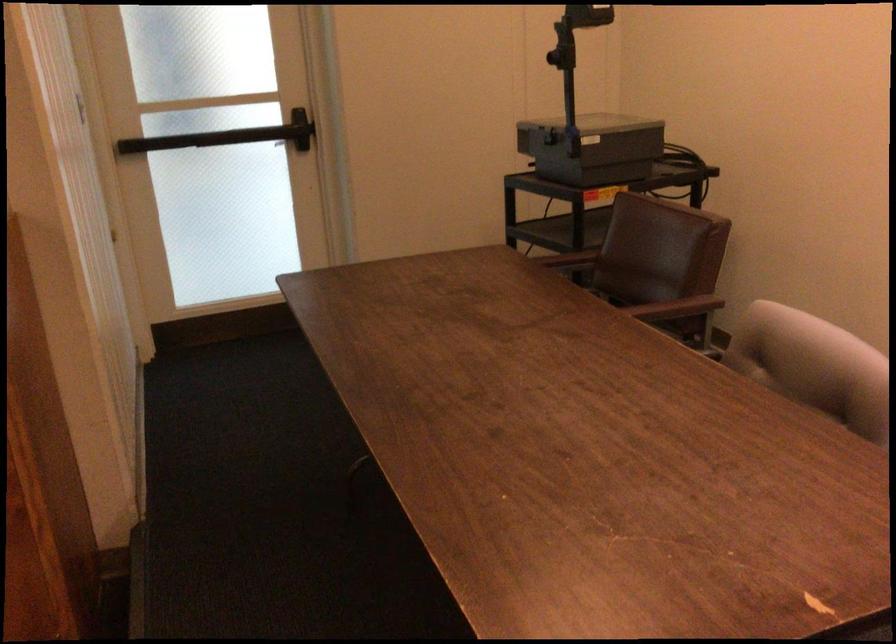
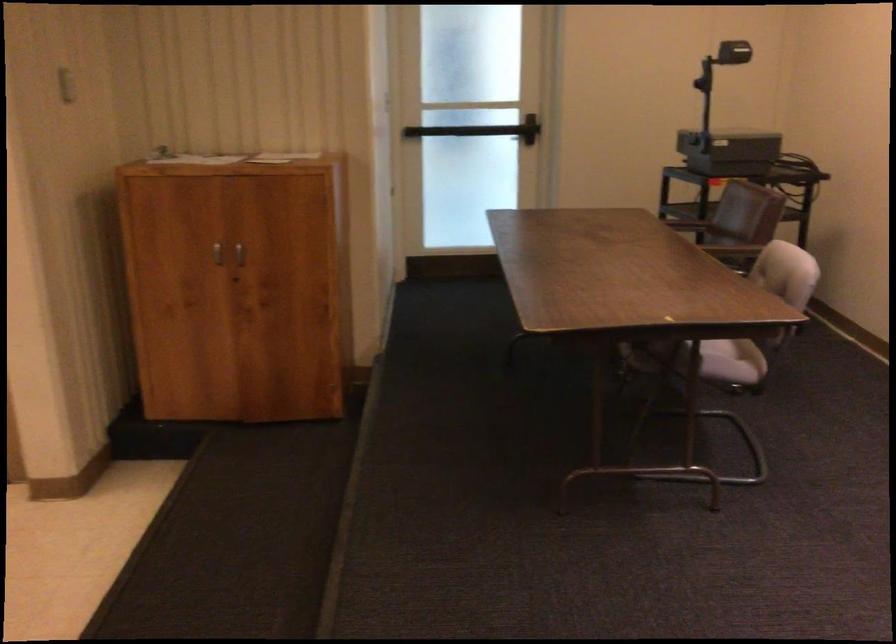
In the second image, find the point that corresponds to (235,138) in the first image.

(479, 129)